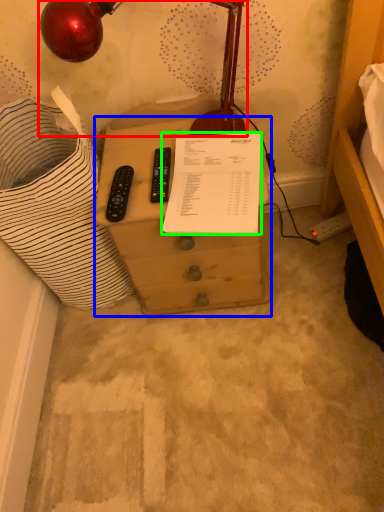
Question: Based on their relative distances, which object is nearer to lamp (highlighted by a red box)? Choose from furniture (highlighted by a blue box) and document (highlighted by a green box).

Choices:
 (A) furniture
 (B) document

Answer: (B)